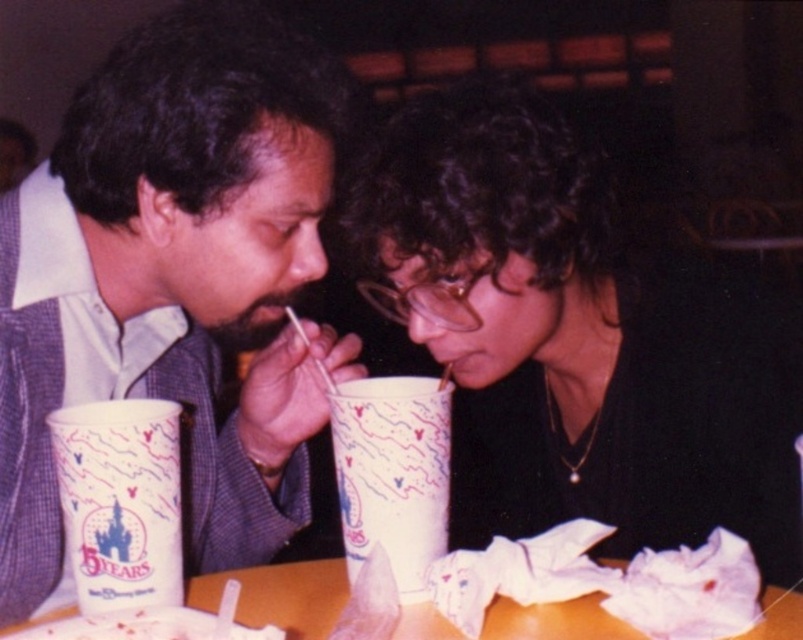
What are the coordinates of the white paper cup at center?

The white paper cup at center is located at coordinates point (393, 474).

You are a photographer standing at a distance. You want to take a closeup photo of the white paper cup at center. Based on the scene description, is the current distance sufficient to capture the cup clearly in the photo?

The white paper cup at center is 23.75 inches away from the camera. Whether this distance is sufficient depends on the camera lens and zoom capabilities. However, given typical handheld photography distances, 23.75 inches might be a bit close for comfortable framing unless using a macro lens. Consider adjusting your position or using appropriate equipment for optimal results.